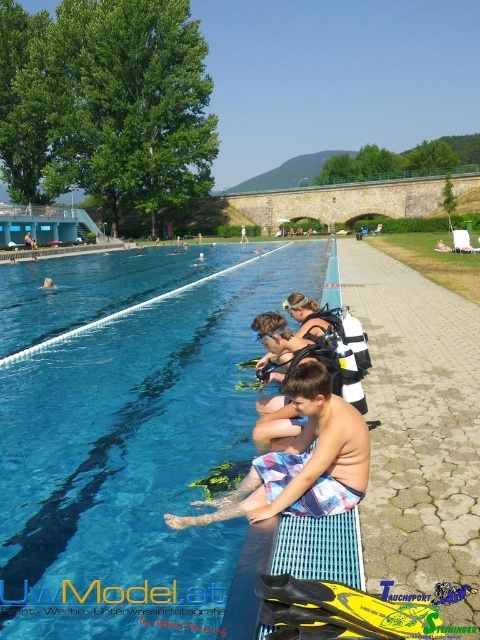
Question: Is blue smooth water at center above multicolored swim trunks at lower center?

Choices:
 (A) no
 (B) yes

Answer: (B)

Question: Which point is farther to the camera?

Choices:
 (A) multicolored swim trunks at lower center
 (B) blue smooth water at center

Answer: (A)

Question: Does blue smooth water at center have a smaller size compared to multicolored swim trunks at lower center?

Choices:
 (A) no
 (B) yes

Answer: (A)

Question: Which point is closer to the camera?

Choices:
 (A) multicolored swim trunks at lower center
 (B) blue smooth water at center

Answer: (B)

Question: Is blue smooth water at center smaller than multicolored swim trunks at lower center?

Choices:
 (A) yes
 (B) no

Answer: (B)